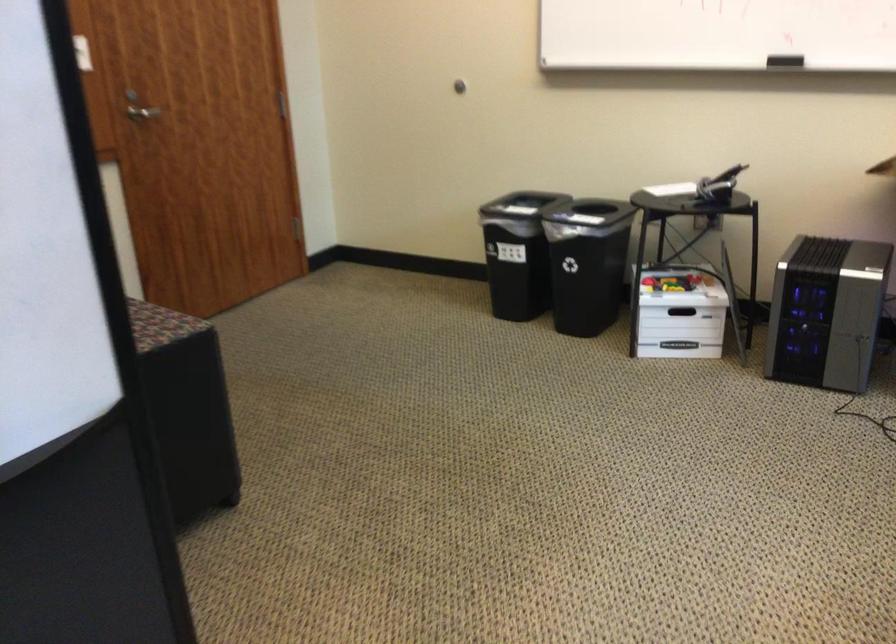
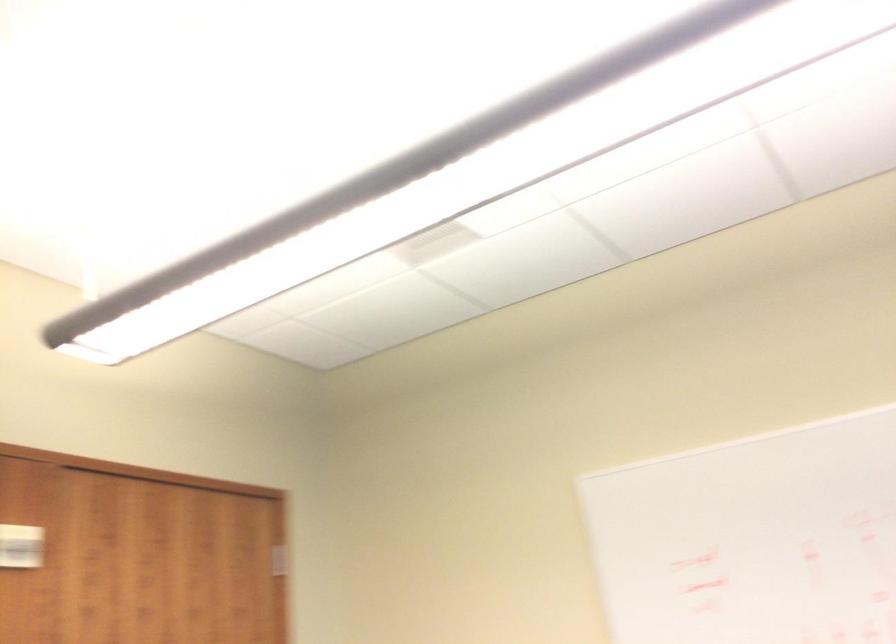
Question: How did the camera likely rotate?

Choices:
 (A) Left
 (B) Right
 (C) Up
 (D) Down

Answer: (C)